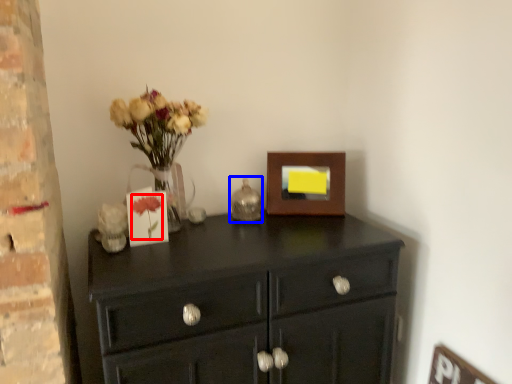
Question: Which object is further to the camera taking this photo, flower (highlighted by a red box) or candle holder (highlighted by a blue box)?

Choices:
 (A) flower
 (B) candle holder

Answer: (B)